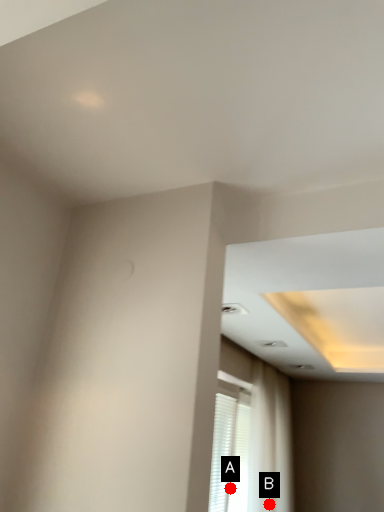
Question: Two points are circled on the image, labeled by A and B beside each circle. Among these points, which one is farthest from the camera?

Choices:
 (A) A is further
 (B) B is further

Answer: (B)